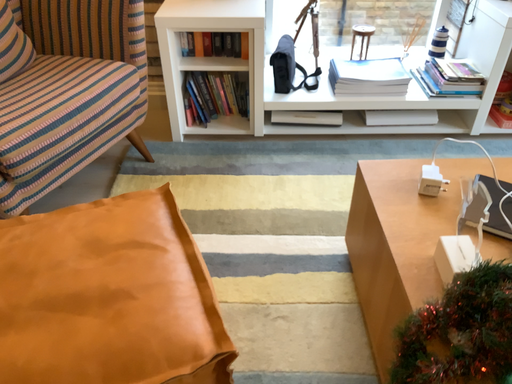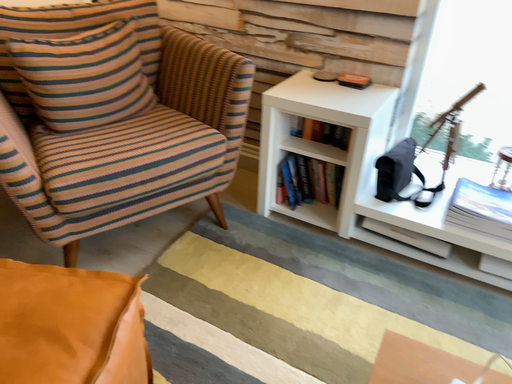
Question: Which way did the camera rotate in the video?

Choices:
 (A) rotated right
 (B) rotated left

Answer: (B)